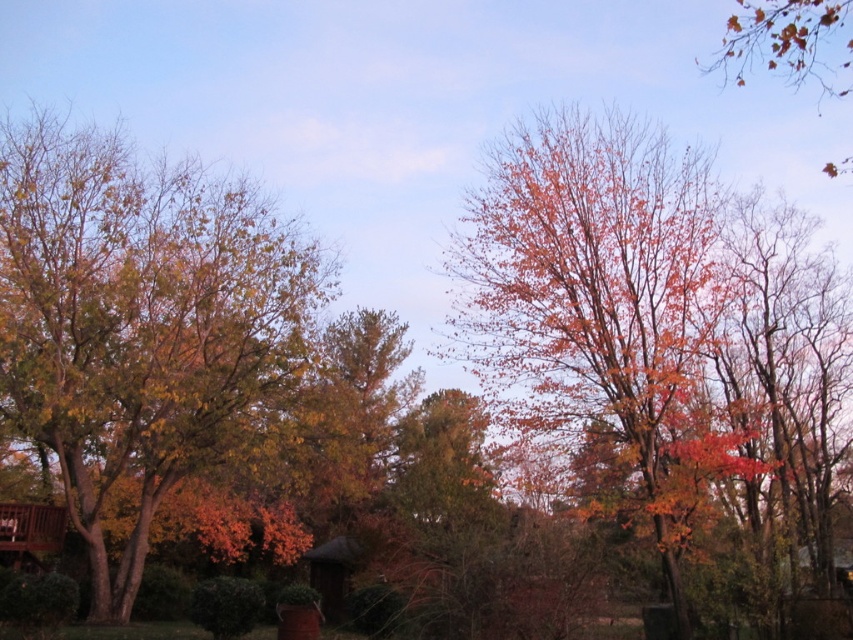
Between point (817, 320) and point (833, 58), which one is positioned in front?

Positioned in front is point (817, 320).

Does shiny orange leaves at center appear over orange leafy tree at upper right?

No, shiny orange leaves at center is not above orange leafy tree at upper right.

Identify the location of shiny orange leaves at center. This screenshot has height=640, width=853. (659, 336).

Locate an element on the screen. This screenshot has height=640, width=853. shiny orange leaves at center is located at coordinates (659, 336).

Does yellow-green foliage at left appear over orange leafy tree at upper right?

No.

Is point (15, 339) closer to camera compared to point (741, 49)?

Yes, it is.

Where is `yellow-green foliage at left`? This screenshot has height=640, width=853. yellow-green foliage at left is located at coordinates (140, 324).

Describe the element at coordinates (659, 336) in the screenshot. I see `shiny orange leaves at center` at that location.

Between point (781, 308) and point (254, 298), which one is positioned behind?

Positioned behind is point (781, 308).

The image size is (853, 640). In order to click on shiny orange leaves at center in this screenshot , I will do `click(659, 336)`.